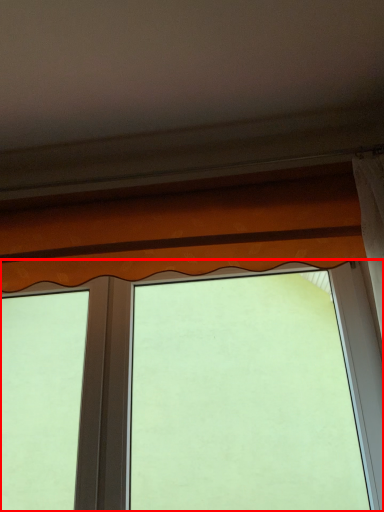
Question: Observing the image, what is the correct spatial positioning of window (annotated by the red box) in reference to curtain?

Choices:
 (A) left
 (B) right

Answer: (A)